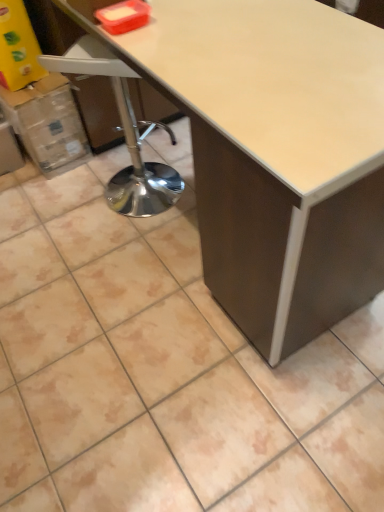
Image resolution: width=384 pixels, height=512 pixels. I want to click on free spot behind white plastic swivel chair at left, so click(153, 145).